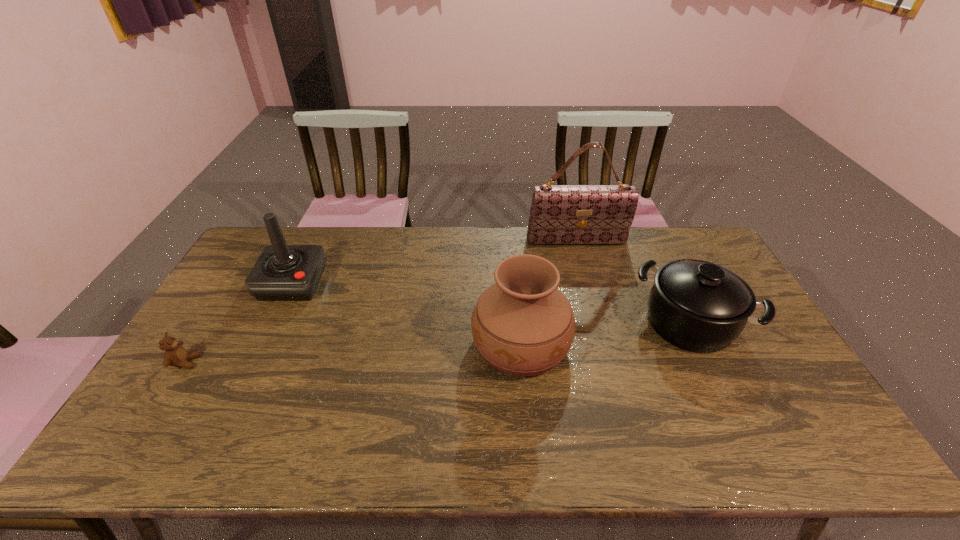
Find the location of a particular element. the second closest object relative to the teddy bear is located at coordinates (522, 325).

Image resolution: width=960 pixels, height=540 pixels. Identify the location of object that is the third closest to the fourth tallest object. (282, 272).

Find the location of `free region that satisfies the following two spatial constraints: 1. on the front side of the urn; 2. at the face of the leftmost object`. free region that satisfies the following two spatial constraints: 1. on the front side of the urn; 2. at the face of the leftmost object is located at coordinates (522, 362).

This screenshot has height=540, width=960. Find the location of `vacant region that satisfies the following two spatial constraints: 1. on the front-facing side of the fourth object from right to left; 2. on the right side of the urn`. vacant region that satisfies the following two spatial constraints: 1. on the front-facing side of the fourth object from right to left; 2. on the right side of the urn is located at coordinates (263, 344).

Image resolution: width=960 pixels, height=540 pixels. I want to click on blank area in the image that satisfies the following two spatial constraints: 1. on the front-facing side of the second object from left to right; 2. at the face of the teddy bear, so coord(254,362).

The height and width of the screenshot is (540, 960). What are the coordinates of `free region that satisfies the following two spatial constraints: 1. on the front-facing side of the urn; 2. on the left side of the fourth object from right to left` in the screenshot? It's located at (263, 344).